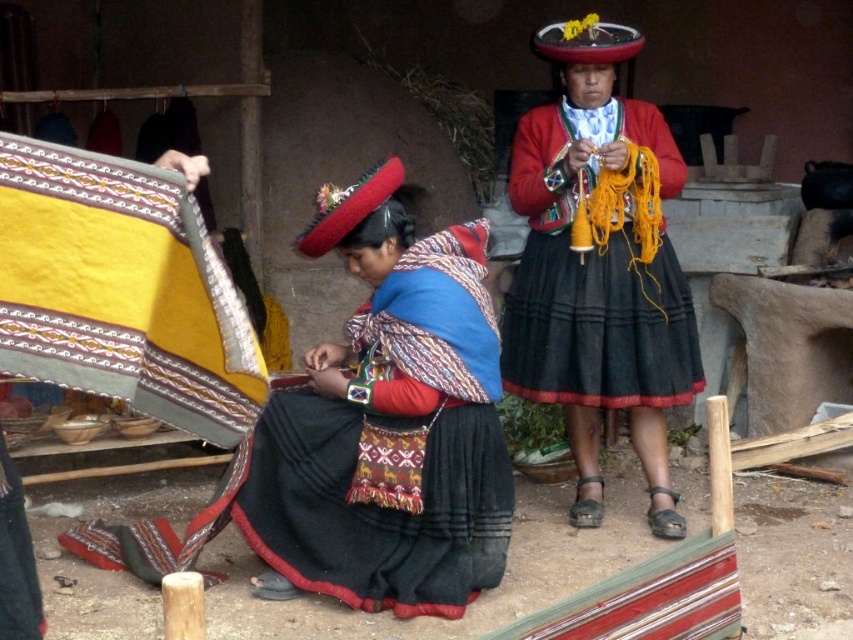
Does point (351, 579) come farther from viewer compared to point (697, 374)?

No, (351, 579) is closer to viewer.

Does point (349, 579) come in front of point (579, 320)?

Yes, it is in front of point (579, 320).

Where is `black woven skirt at lower left`? The height and width of the screenshot is (640, 853). black woven skirt at lower left is located at coordinates (390, 436).

Image resolution: width=853 pixels, height=640 pixels. Identify the location of black woven skirt at lower left. (390, 436).